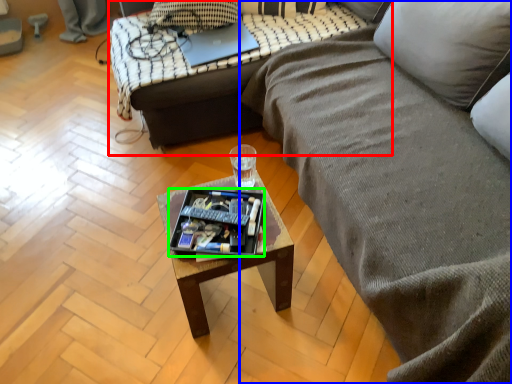
Question: Which is nearer to the studio couch (highlighted by a red box)? studio couch (highlighted by a blue box) or tray (highlighted by a green box).

Choices:
 (A) studio couch
 (B) tray

Answer: (A)